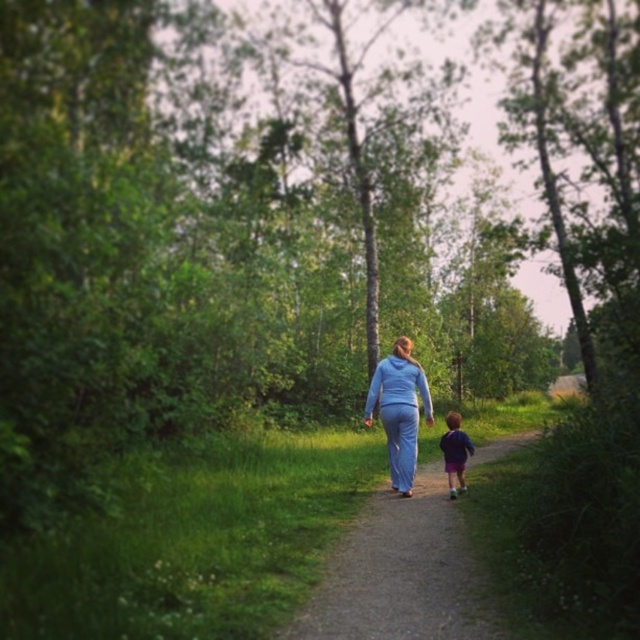
Question: Can you confirm if dirt path at center is positioned to the right of purple fabric boy at lower right?

Choices:
 (A) yes
 (B) no

Answer: (B)

Question: Which of the following is the farthest from the observer?

Choices:
 (A) blue fabric pants at center
 (B) dirt path at center

Answer: (A)

Question: Which object is positioned farthest from the purple fabric boy at lower right?

Choices:
 (A) dirt path at center
 (B) blue fabric pants at center

Answer: (A)

Question: Can you confirm if dirt path at center is positioned to the right of purple fabric boy at lower right?

Choices:
 (A) yes
 (B) no

Answer: (B)

Question: Can you confirm if blue fabric pants at center is bigger than purple fabric boy at lower right?

Choices:
 (A) yes
 (B) no

Answer: (A)

Question: Among these points, which one is nearest to the camera?

Choices:
 (A) (461, 448)
 (B) (410, 508)
 (C) (413, 403)

Answer: (B)